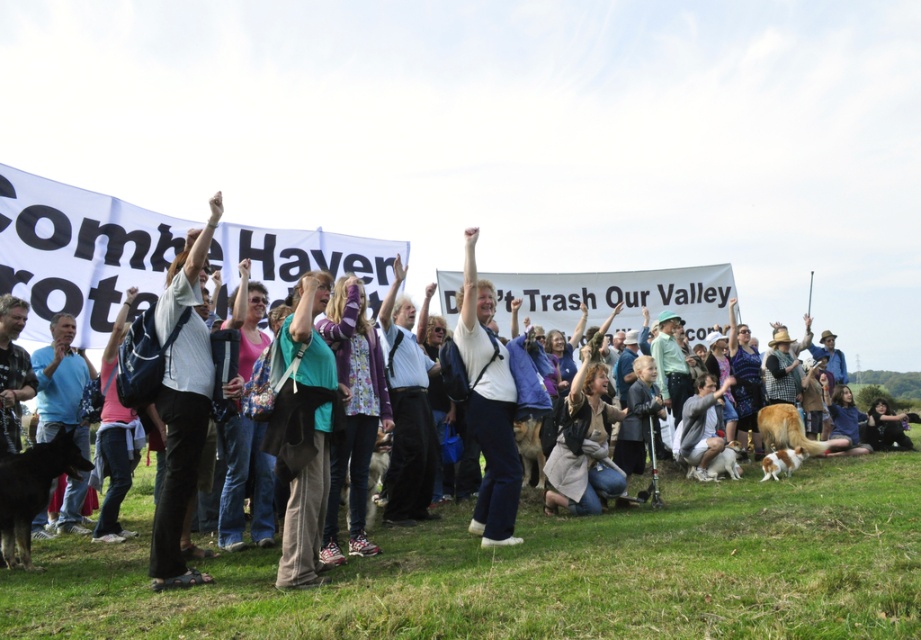
Is white cotton shirt at center taller than light gray cotton shirt at center?

Incorrect, white cotton shirt at center's height is not larger of light gray cotton shirt at center's.

Between white cotton shirt at center and light gray cotton shirt at center, which one is positioned higher?

light gray cotton shirt at center is above.

Who is more forward, (342, 392) or (210, 228)?

Positioned in front is point (210, 228).

Locate an element on the screen. Image resolution: width=921 pixels, height=640 pixels. white cotton shirt at center is located at coordinates (190, 264).

Image resolution: width=921 pixels, height=640 pixels. What do you see at coordinates (182, 401) in the screenshot?
I see `light gray cotton shirt at center` at bounding box center [182, 401].

Which of these two, light gray cotton shirt at center or blue cotton shirt at left, stands taller?

Standing taller between the two is light gray cotton shirt at center.

Which is in front, point (177, 522) or point (67, 362)?

Positioned in front is point (177, 522).

The width and height of the screenshot is (921, 640). I want to click on light gray cotton shirt at center, so pos(182,401).

Does point (167, 476) come in front of point (462, 288)?

Yes, point (167, 476) is in front of point (462, 288).

Can you confirm if light gray cotton shirt at center is taller than white matte jacket at center?

Indeed, light gray cotton shirt at center has a greater height compared to white matte jacket at center.

Is point (166, 513) positioned before point (485, 346)?

That is True.

The image size is (921, 640). What are the coordinates of `light gray cotton shirt at center` in the screenshot? It's located at (182, 401).